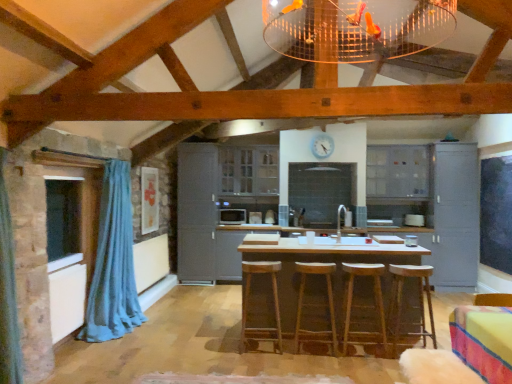
Identify the location of vacant space underneath brown wooden bar stool at center, placed as the 1th bar stool when sorted from left to right (from a real-world perspective). The height and width of the screenshot is (384, 512). (257, 349).